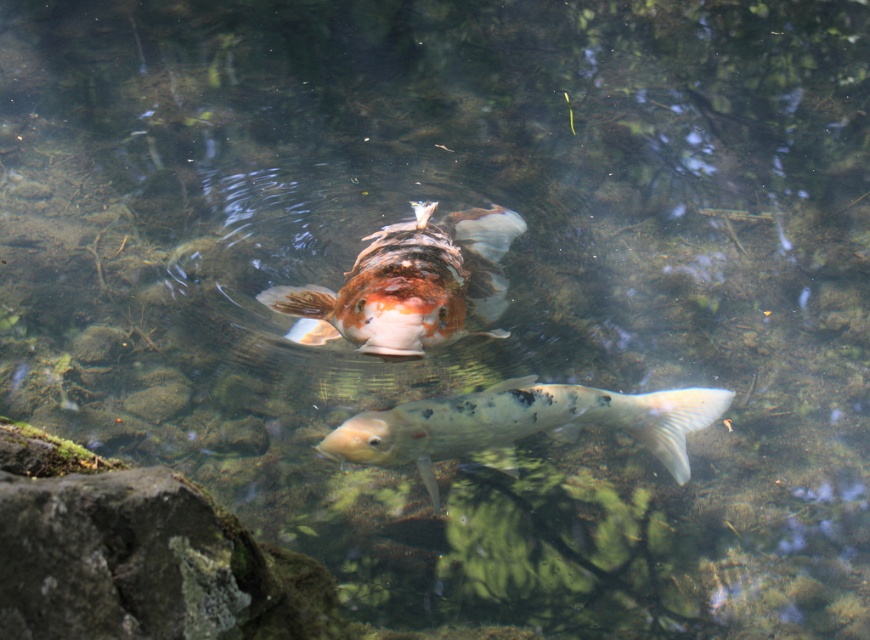
Question: Which point is farther from the camera taking this photo?

Choices:
 (A) (478, 308)
 (B) (469, 419)

Answer: (A)

Question: Which object is farther from the camera taking this photo?

Choices:
 (A) shiny orange and white fish at center
 (B) speckled white fish at center

Answer: (B)

Question: Which of the following is the farthest from the observer?

Choices:
 (A) shiny orange and white fish at center
 (B) speckled white fish at center

Answer: (B)

Question: From the image, what is the correct spatial relationship of shiny orange and white fish at center in relation to speckled white fish at center?

Choices:
 (A) left
 (B) right

Answer: (A)

Question: Is shiny orange and white fish at center above speckled white fish at center?

Choices:
 (A) yes
 (B) no

Answer: (A)

Question: Does shiny orange and white fish at center come in front of speckled white fish at center?

Choices:
 (A) no
 (B) yes

Answer: (B)